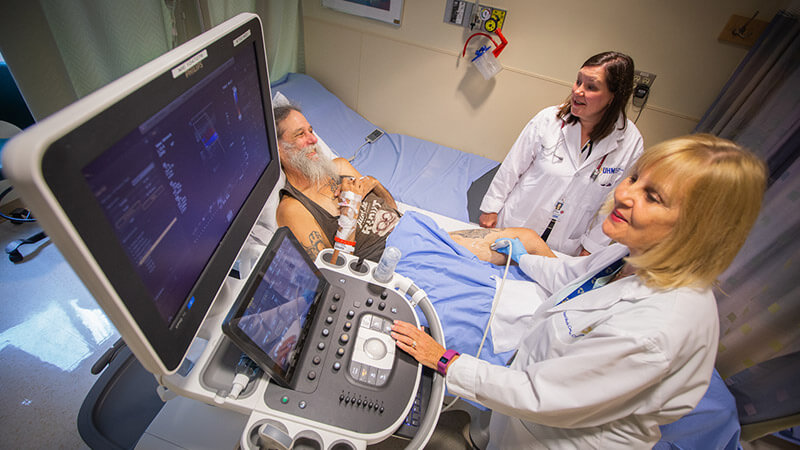
Identify the location of screens. (168, 199), (277, 311).